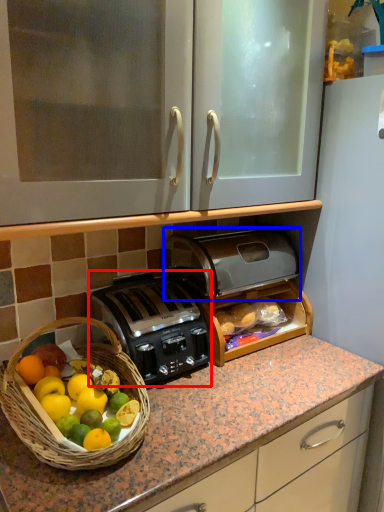
Question: Which object appears closest to the camera in this image, toaster (highlighted by a red box) or toaster (highlighted by a blue box)?

Choices:
 (A) toaster
 (B) toaster

Answer: (A)